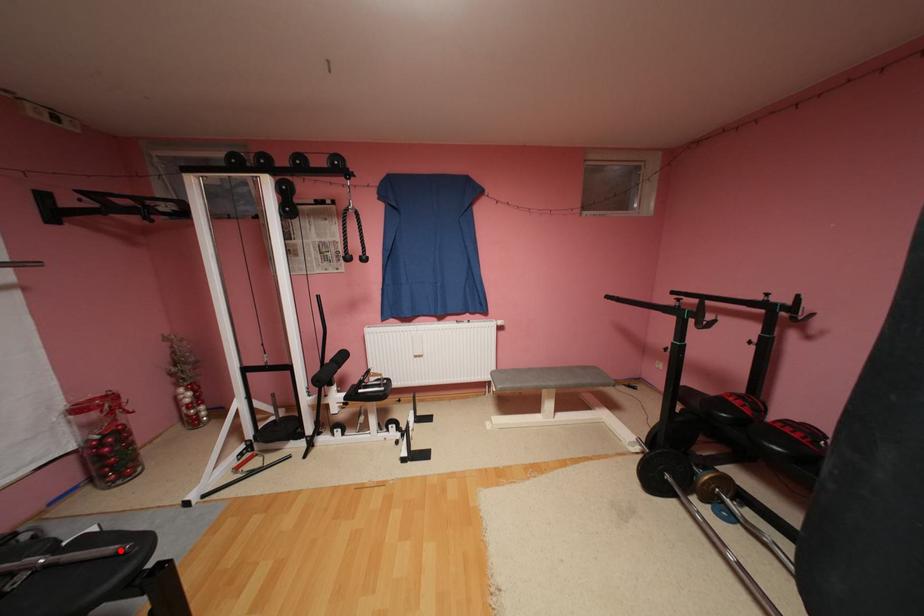
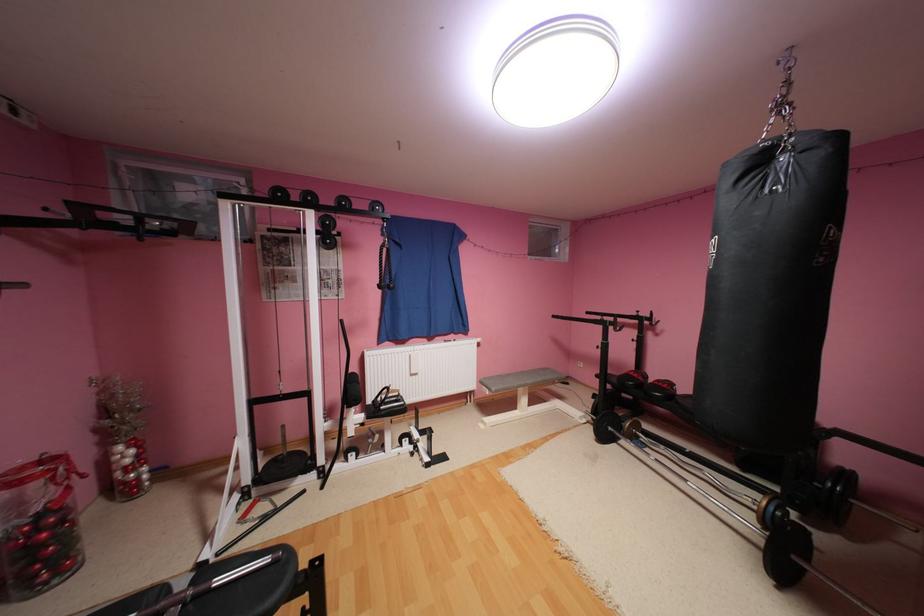
Find the pixel in the second image that matches the highlighted location in the first image.

(276, 560)